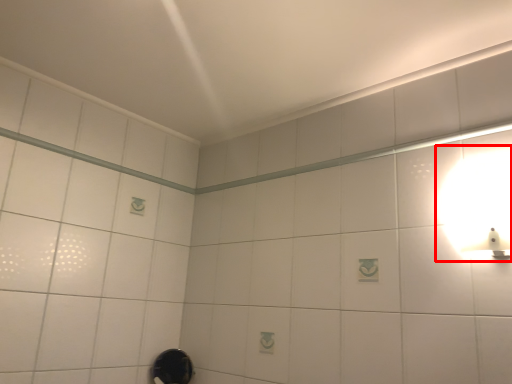
Question: In this image, where is light fixture (annotated by the red box) located relative to shower?

Choices:
 (A) right
 (B) left

Answer: (A)